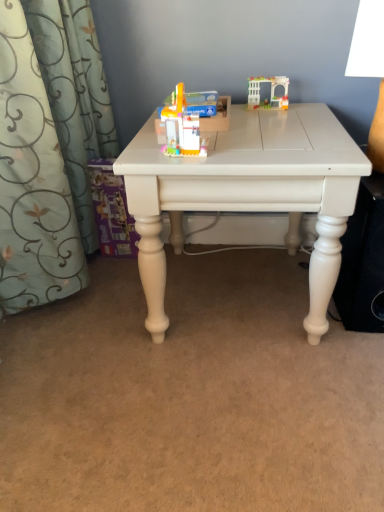
At what (x,y) coordinates should I click in order to perform the action: click on unoccupied region to the right of translucent plastic archway at upper right, marked as the 1th toy in a right-to-left arrangement. Please return your answer as a coordinate pair (x, y). This screenshot has width=384, height=512. Looking at the image, I should click on (306, 106).